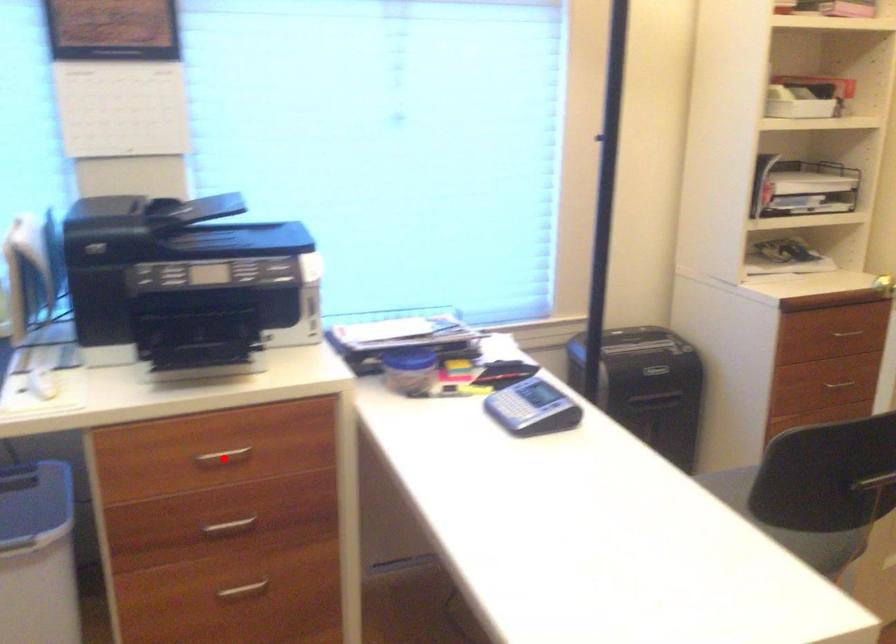
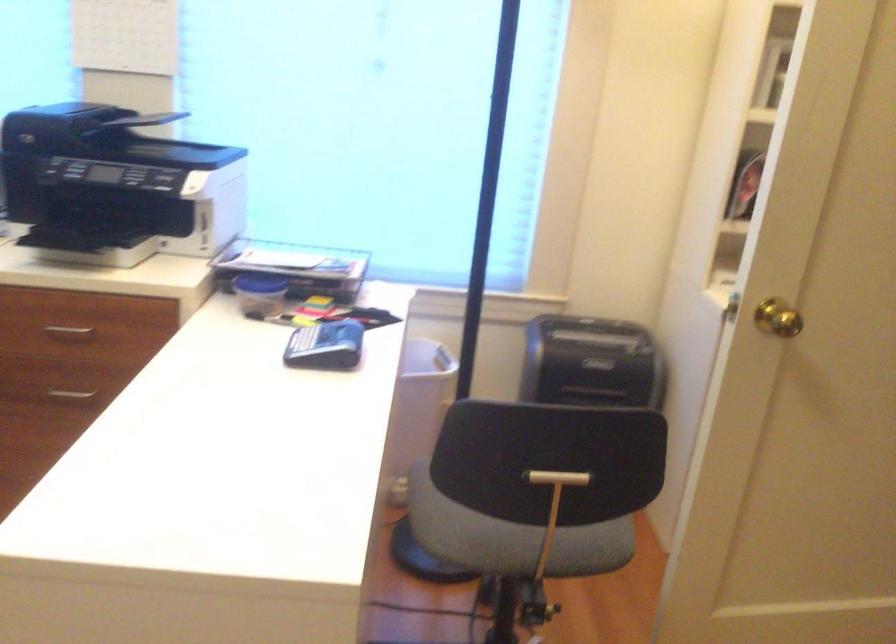
Question: I am providing you with two images of the same scene from different viewpoints. Given a red point in image1, look at the same physical point in image2. Is it:

Choices:
 (A) Closer to the viewpoint
 (B) Farther from the viewpoint

Answer: (B)